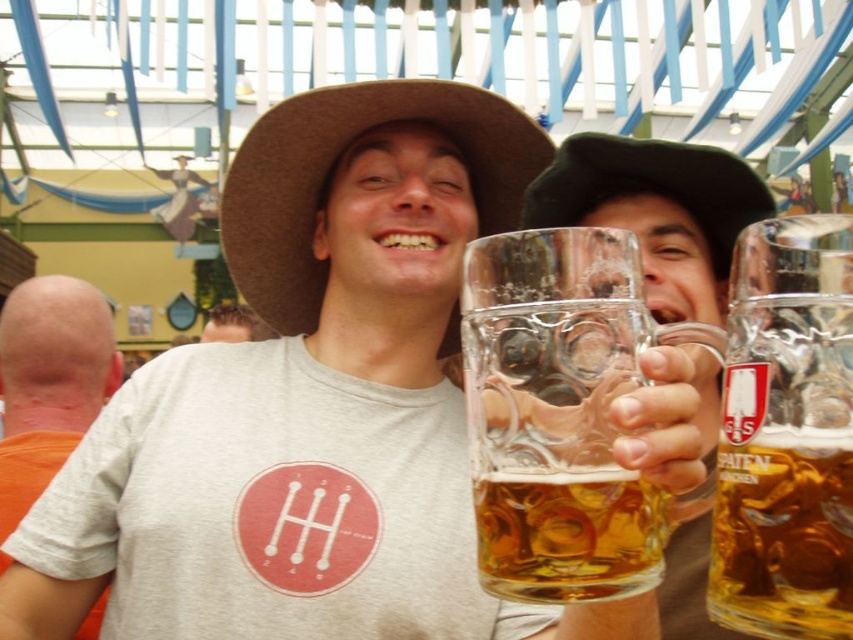
Which is below, clear glass mug at right or brown felt cowboy hat at center?

clear glass mug at right is below.

Locate an element on the screen. The width and height of the screenshot is (853, 640). clear glass mug at right is located at coordinates (786, 435).

Locate an element on the screen. Image resolution: width=853 pixels, height=640 pixels. clear glass mug at right is located at coordinates (786, 435).

Image resolution: width=853 pixels, height=640 pixels. In order to click on clear glass mug at right in this screenshot , I will do `click(786, 435)`.

From the picture: Does clear glass mug at center have a larger size compared to matte gray t-shirt at center?

No, clear glass mug at center is not bigger than matte gray t-shirt at center.

Is clear glass mug at center wider than matte gray t-shirt at center?

No.

The image size is (853, 640). What are the coordinates of `clear glass mug at center` in the screenshot? It's located at (561, 413).

Does clear glass mug at center have a larger size compared to clear glass mug at right?

Actually, clear glass mug at center might be smaller than clear glass mug at right.

Which is more to the left, clear glass mug at center or clear glass mug at right?

clear glass mug at center

Which is behind, point (529, 499) or point (846, 380)?

Positioned behind is point (529, 499).

Where is `clear glass mug at center`? clear glass mug at center is located at coordinates (561, 413).